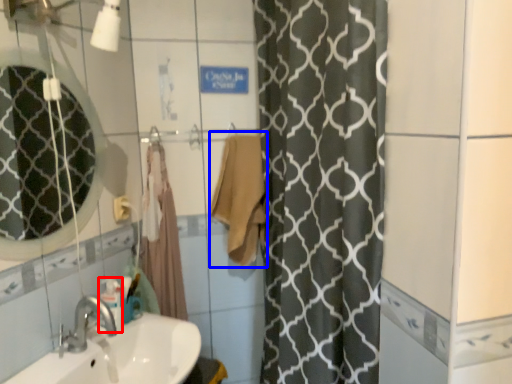
Question: Which of the following is the closest to the observer, toiletry (highlighted by a red box) or bath towel (highlighted by a blue box)?

Choices:
 (A) toiletry
 (B) bath towel

Answer: (A)